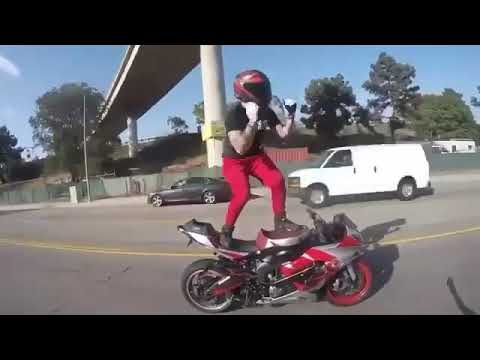
Image resolution: width=480 pixels, height=360 pixels. I want to click on pillar, so click(x=212, y=85), click(x=131, y=132).